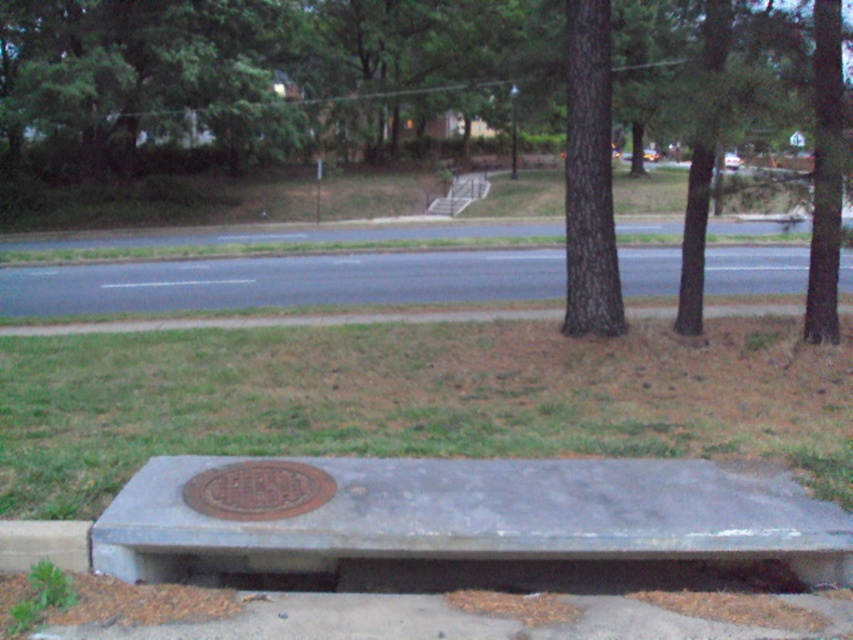
Question: Is green grass at lower center to the left of gray concrete curb at lower left from the viewer's perspective?

Choices:
 (A) yes
 (B) no

Answer: (B)

Question: Is green grass at lower center positioned before brown rough bark tree at center?

Choices:
 (A) no
 (B) yes

Answer: (B)

Question: Which object is closer to the camera taking this photo?

Choices:
 (A) rusty metal manhole cover at center
 (B) smooth concrete bench at center

Answer: (B)

Question: Is green grass at lower center smaller than rusty metal manhole cover at center?

Choices:
 (A) no
 (B) yes

Answer: (A)

Question: Which object is closer to the camera taking this photo?

Choices:
 (A) green grass at lower center
 (B) smooth concrete bench at center

Answer: (B)

Question: Which point is farther to the camera?

Choices:
 (A) brown textured tree at center
 (B) rusty metal manhole cover at center
 (C) gray concrete curb at lower left

Answer: (A)